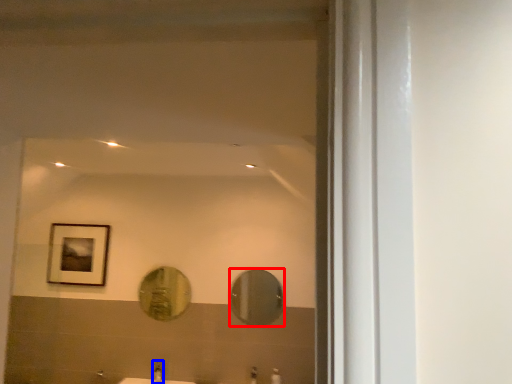
Question: Among these objects, which one is farthest to the camera, mirror (highlighted by a red box) or faucet (highlighted by a blue box)?

Choices:
 (A) mirror
 (B) faucet

Answer: (A)